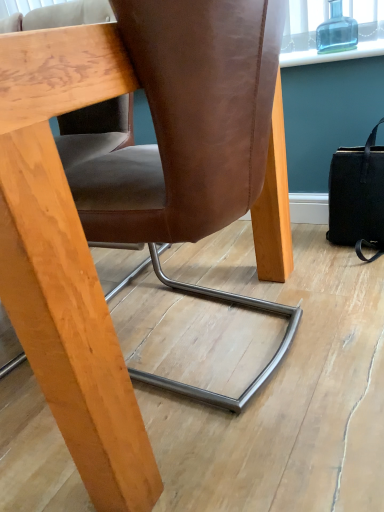
Question: Is transparent glass bottle at upper right shorter than brown leather chair at center?

Choices:
 (A) no
 (B) yes

Answer: (B)

Question: Is transparent glass bottle at upper right not inside brown leather chair at center?

Choices:
 (A) no
 (B) yes

Answer: (B)

Question: Is transparent glass bottle at upper right further to the viewer compared to brown leather chair at center?

Choices:
 (A) no
 (B) yes

Answer: (B)

Question: Is transparent glass bottle at upper right turned away from brown leather chair at center?

Choices:
 (A) no
 (B) yes

Answer: (A)

Question: Is transparent glass bottle at upper right bigger than brown leather chair at center?

Choices:
 (A) yes
 (B) no

Answer: (B)

Question: Is transparent glass bottle at upper right touching brown leather chair at center?

Choices:
 (A) yes
 (B) no

Answer: (B)

Question: Is there a large distance between black leather handbag at right and brown leather chair at center?

Choices:
 (A) yes
 (B) no

Answer: (B)

Question: From the image's perspective, is black leather handbag at right below brown leather chair at center?

Choices:
 (A) no
 (B) yes

Answer: (A)

Question: Is black leather handbag at right oriented towards brown leather chair at center?

Choices:
 (A) yes
 (B) no

Answer: (B)

Question: Considering the relative sizes of black leather handbag at right and brown leather chair at center in the image provided, is black leather handbag at right shorter than brown leather chair at center?

Choices:
 (A) yes
 (B) no

Answer: (A)

Question: Is black leather handbag at right positioned with its back to brown leather chair at center?

Choices:
 (A) no
 (B) yes

Answer: (A)

Question: Is brown leather chair at center completely or partially inside black leather handbag at right?

Choices:
 (A) yes
 (B) no

Answer: (B)

Question: Are brown leather chair at center and black leather handbag at right far apart?

Choices:
 (A) no
 (B) yes

Answer: (A)